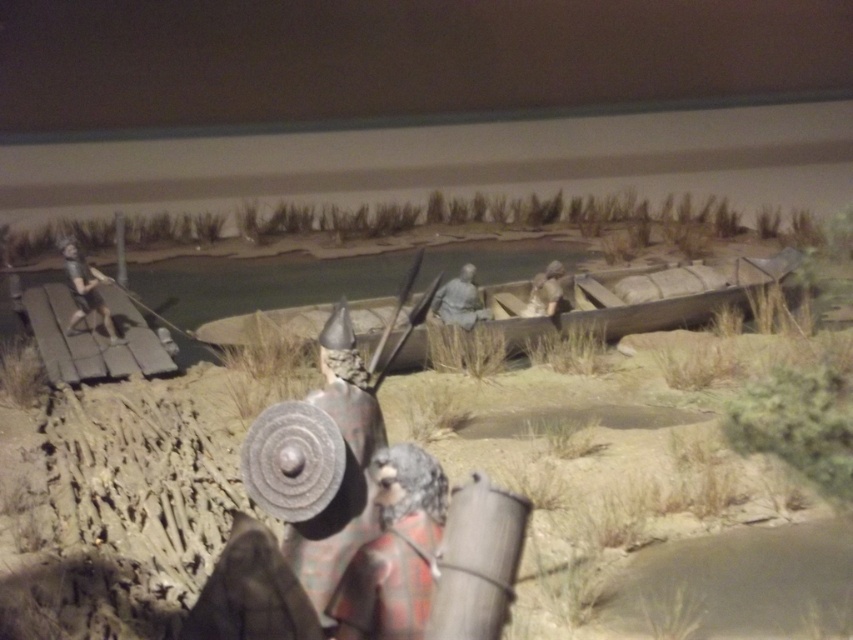
In the scene shown: Can you confirm if matte gray helmet at left is taller than gray stone figure at center?

Correct, matte gray helmet at left is much taller as gray stone figure at center.

Measure the distance between point (x=78, y=314) and camera.

Point (x=78, y=314) and camera are 17.17 feet apart from each other.

This screenshot has width=853, height=640. What are the coordinates of `matte gray helmet at left` in the screenshot? It's located at (85, 289).

Which is in front, point (293, 332) or point (102, 308)?

Point (102, 308) is in front.

Can you confirm if wooden boat at center is positioned below matte gray helmet at left?

No.

At what (x,y) coordinates should I click in order to perform the action: click on wooden boat at center. Please return your answer as a coordinate pair (x, y). Image resolution: width=853 pixels, height=640 pixels. Looking at the image, I should click on (639, 298).

From the picture: Does wooden boat at center have a greater width compared to gray stone figure at center?

Yes.

Which is in front, point (633, 314) or point (483, 316)?

Point (483, 316) is more forward.

The height and width of the screenshot is (640, 853). What are the coordinates of `wooden boat at center` in the screenshot? It's located at (639, 298).